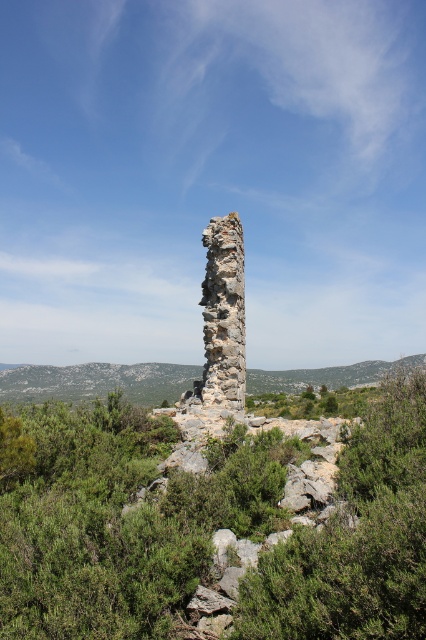
You are standing near the solitary stone tower and notice two green leafy shrubs. One is labeled as green leafy shrubs at center and the other as green leafy shrub at center. Which shrub is directly above the other?

The green leafy shrub at center is directly above the green leafy shrubs at center because the shrubs at center are positioned under it.

You are a hiker who wants to climb the green mossy hillside at center. You notice there are green leafy shrubs at center nearby. Which of the two has a greater height?

The green leafy shrubs at center has a lesser height compared to green mossy hillside at center, so the green mossy hillside at center is taller.